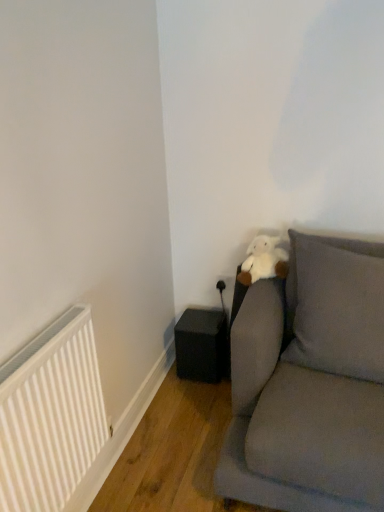
Question: Looking at the image, does velvet gray couch at right seem bigger or smaller compared to white matte radiator at lower left?

Choices:
 (A) small
 (B) big

Answer: (B)

Question: From a real-world perspective, is velvet gray couch at right positioned above or below white matte radiator at lower left?

Choices:
 (A) below
 (B) above

Answer: (A)

Question: Estimate the real-world distances between objects in this image. Which object is closer to the velvet gray couch at right?

Choices:
 (A) white plush at upper right
 (B) white matte radiator at lower left
 (C) gray fabric pillow at upper right
 (D) black matte speaker at lower left

Answer: (C)

Question: Estimate the real-world distances between objects in this image. Which object is closer to the gray fabric pillow at upper right?

Choices:
 (A) white plush at upper right
 (B) white matte radiator at lower left
 (C) black matte speaker at lower left
 (D) velvet gray couch at right

Answer: (D)